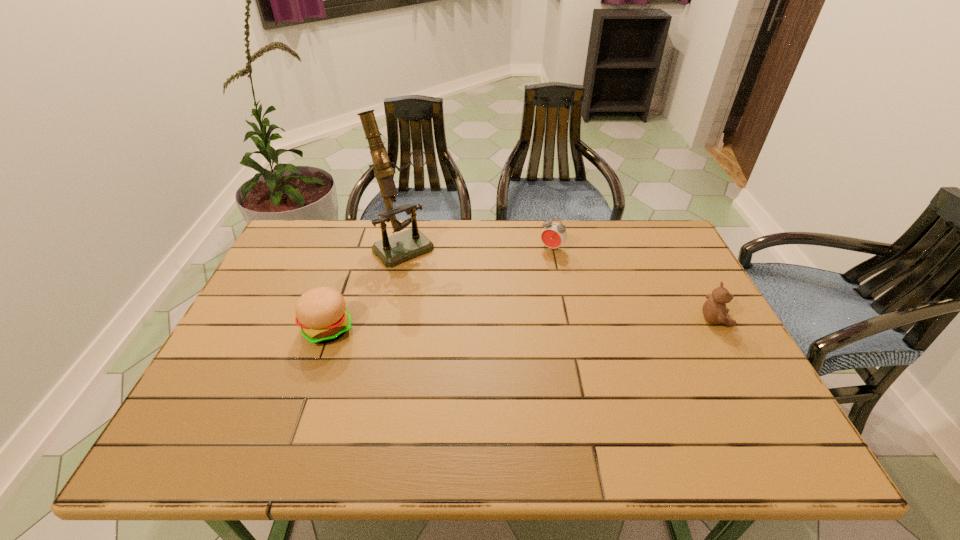
Identify the location of object that is the closest one to the hamburger. (400, 247).

I want to click on object that is the third closest to the rightmost object, so click(321, 313).

The height and width of the screenshot is (540, 960). I want to click on vacant area in the image that satisfies the following two spatial constraints: 1. on the front side of the third object from left to right; 2. on the front-facing side of the teddy bear, so click(x=566, y=319).

At what (x,y) coordinates should I click in order to perform the action: click on vacant region that satisfies the following two spatial constraints: 1. on the front side of the alarm clock; 2. on the front-facing side of the rightmost object. Please return your answer as a coordinate pair (x, y). Looking at the image, I should click on (566, 319).

Locate an element on the screen. The height and width of the screenshot is (540, 960). vacant position in the image that satisfies the following two spatial constraints: 1. on the back side of the hamburger; 2. on the front-facing side of the teddy bear is located at coordinates (332, 319).

Locate an element on the screen. The image size is (960, 540). blank space that satisfies the following two spatial constraints: 1. on the back side of the rightmost object; 2. on the front-facing side of the hamburger is located at coordinates pos(332,319).

I want to click on free spot that satisfies the following two spatial constraints: 1. on the front side of the teddy bear; 2. on the front-facing side of the alarm clock, so click(x=566, y=319).